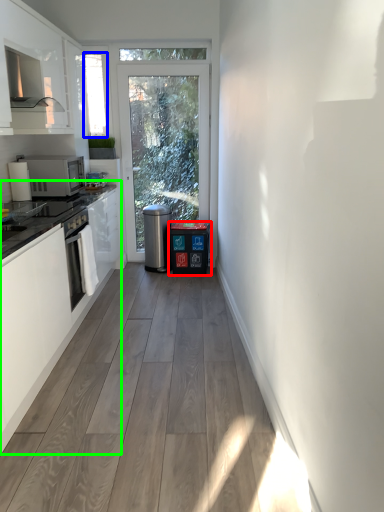
Question: Which is farther away from dish washer (highlighted by a red box)? window screen (highlighted by a blue box) or cabinetry (highlighted by a green box)?

Choices:
 (A) window screen
 (B) cabinetry

Answer: (B)